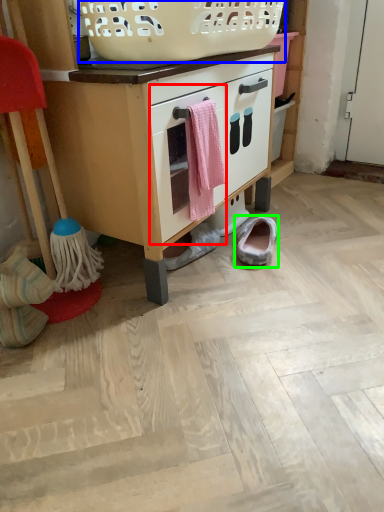
Question: Which is nearer to the drawer (highlighted by a red box)? basket (highlighted by a blue box) or footwear (highlighted by a green box).

Choices:
 (A) basket
 (B) footwear

Answer: (A)